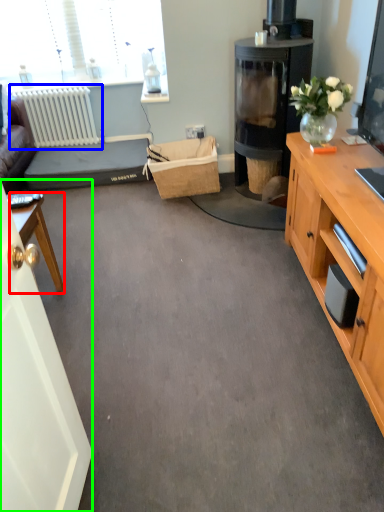
Question: Based on their relative distances, which object is farther from desk (highlighted by a red box)? Choose from radiator (highlighted by a blue box) and glass door (highlighted by a green box).

Choices:
 (A) radiator
 (B) glass door

Answer: (A)